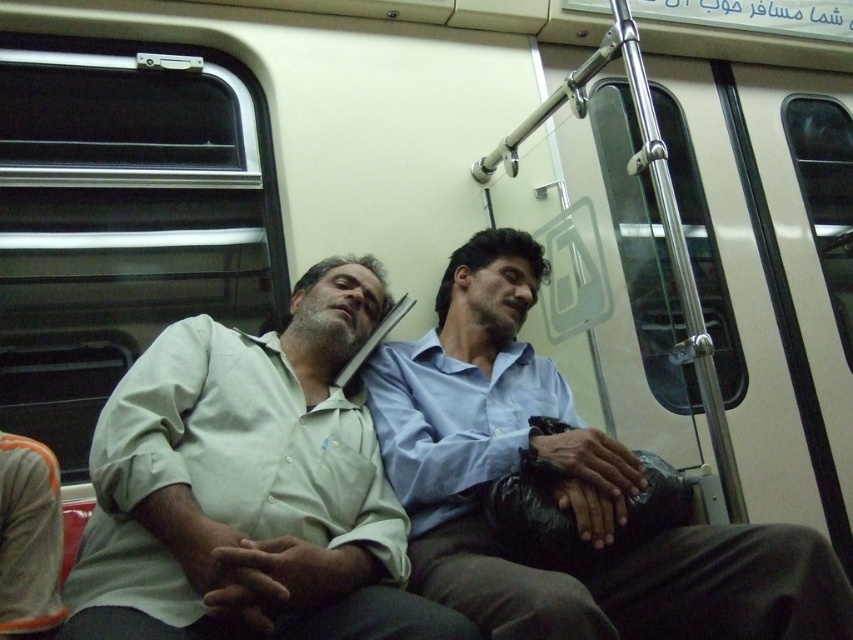
Question: Which point appears closest to the camera in this image?

Choices:
 (A) (312, 403)
 (B) (570, 476)

Answer: (B)

Question: Can you confirm if light green cotton shirt at center is positioned below blue smooth shirt at center?

Choices:
 (A) no
 (B) yes

Answer: (A)

Question: Does light green cotton shirt at center appear over blue smooth shirt at center?

Choices:
 (A) no
 (B) yes

Answer: (B)

Question: Is light green cotton shirt at center bigger than blue smooth shirt at center?

Choices:
 (A) no
 (B) yes

Answer: (A)